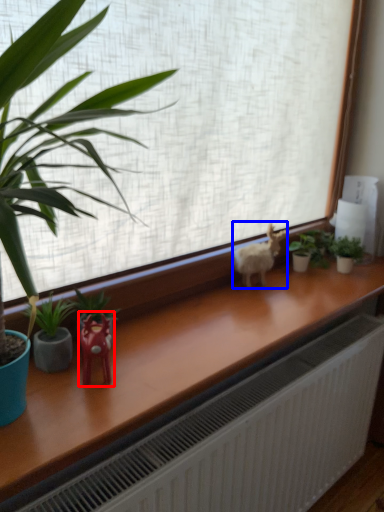
Question: Which object appears farthest to the camera in this image, miniature (highlighted by a red box) or animal (highlighted by a blue box)?

Choices:
 (A) miniature
 (B) animal

Answer: (B)